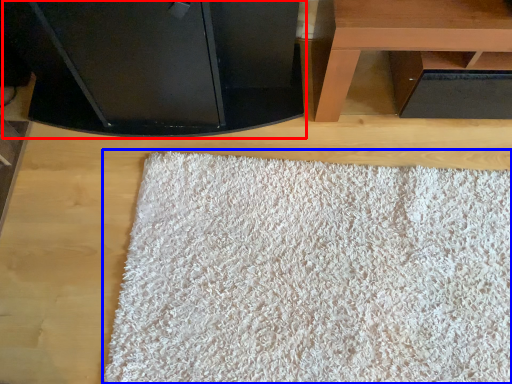
Question: Which point is further to the camera, furniture (highlighted by a red box) or mat (highlighted by a blue box)?

Choices:
 (A) furniture
 (B) mat

Answer: (B)